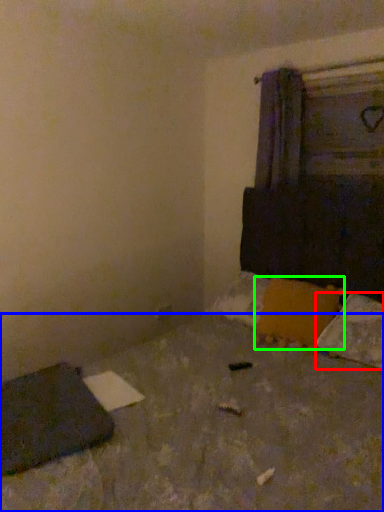
Question: Estimate the real-world distances between objects in this image. Which object is closer to pillow (highlighted by a red box), concrete (highlighted by a blue box) or pillow (highlighted by a green box)?

Choices:
 (A) concrete
 (B) pillow

Answer: (B)